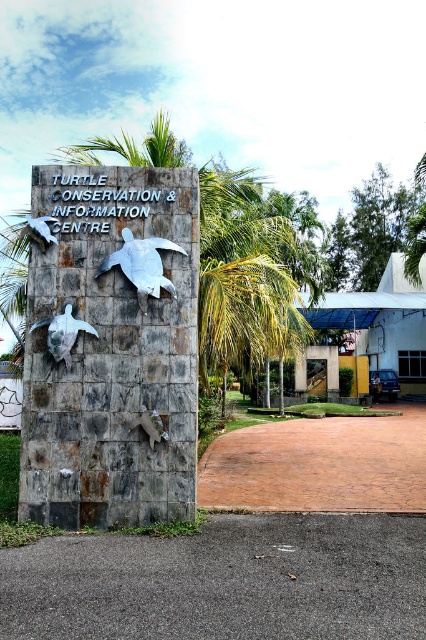
Is point (134, 284) closer to viewer compared to point (54, 328)?

No, it is behind (54, 328).

Can you confirm if metallic turtle at center is taller than matte silver turtle at lower left?

Indeed, metallic turtle at center has a greater height compared to matte silver turtle at lower left.

Between point (135, 285) and point (69, 320), which one is positioned in front?

Point (69, 320) is more forward.

Image resolution: width=426 pixels, height=640 pixels. Identify the location of metallic turtle at center. (141, 264).

Is rusty stone turtles at center bigger than matte silver turtle at lower left?

Yes, rusty stone turtles at center is bigger than matte silver turtle at lower left.

Is point (86, 301) positioned in front of point (77, 332)?

That is False.

Which is in front, point (184, 385) or point (69, 317)?

Point (184, 385) is more forward.

Where is `rusty stone turtles at center`? Image resolution: width=426 pixels, height=640 pixels. rusty stone turtles at center is located at coordinates (112, 348).

Measure the distance between rusty stone turtles at center and metallic turtle at center.

rusty stone turtles at center and metallic turtle at center are 18.81 inches apart.

Does rusty stone turtles at center appear on the left side of metallic turtle at center?

Indeed, rusty stone turtles at center is positioned on the left side of metallic turtle at center.

Describe the element at coordinates (112, 348) in the screenshot. I see `rusty stone turtles at center` at that location.

Identify the location of rusty stone turtles at center. (112, 348).